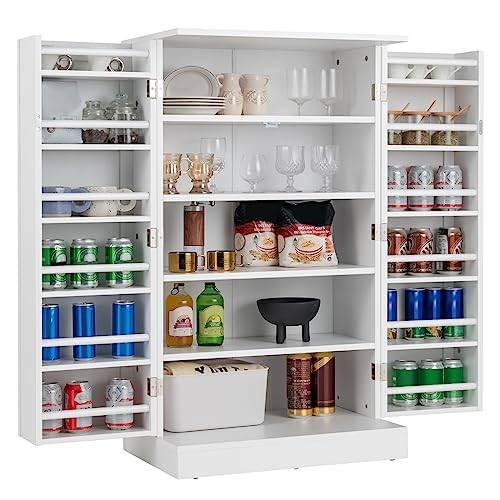
Locate an element on the screen. The image size is (500, 500). glassware is located at coordinates (329, 82), (296, 86), (262, 170), (224, 145), (280, 157), (329, 158), (201, 170), (174, 169).